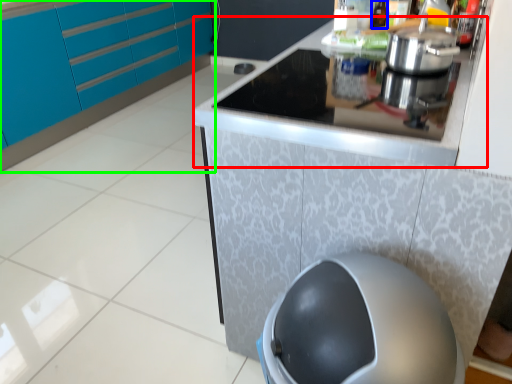
Question: Which object is the farthest from counter top (highlighted by a red box)? Choose among these: bottle (highlighted by a blue box) or cabinetry (highlighted by a green box).

Choices:
 (A) bottle
 (B) cabinetry

Answer: (B)